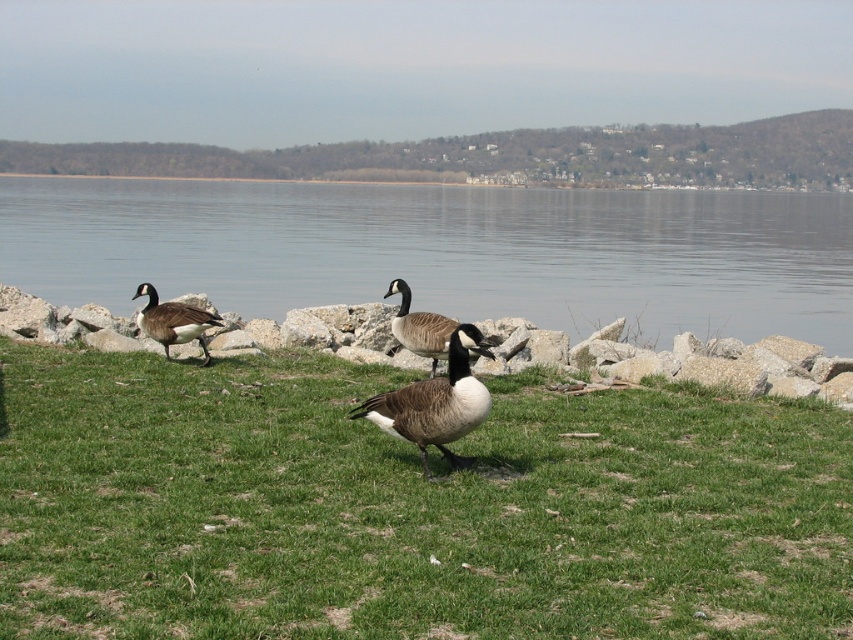
You are a photographer trying to capture the brown speckled goose at center in your shot. The smooth gray water at center is also in your frame. Which object takes up more space in the image?

The smooth gray water at center takes up more space in the image because it is bigger than the brown speckled goose at center.

You are a photographer aiming to capture a photo of the brown speckled goose at center and the gray rock at center. From your current position, which object would you need to pan your camera to the right to include in the frame?

To include the gray rock at center in the frame, you would need to pan your camera to the right since it is positioned to the right of the brown speckled goose at center.